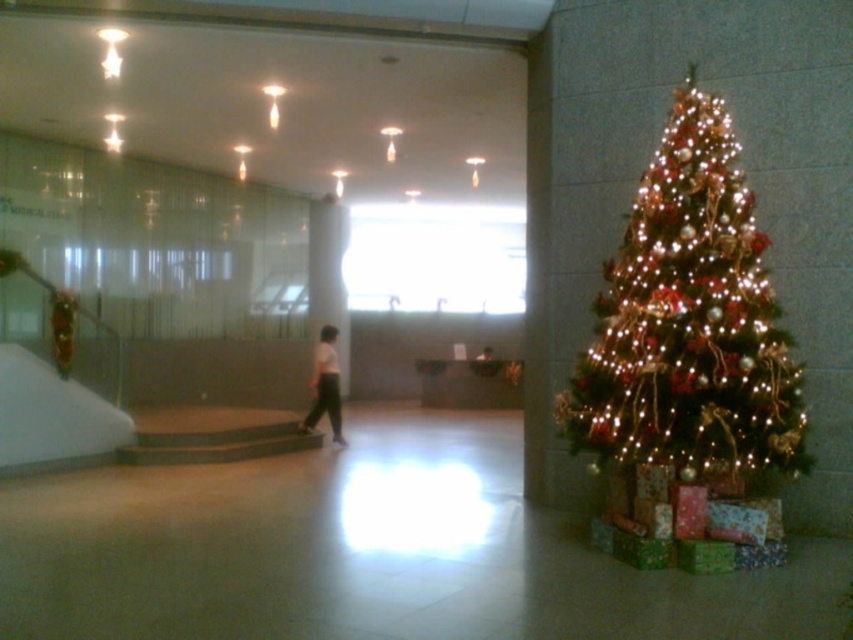
Question: Which object is closer to the camera taking this photo?

Choices:
 (A) iridescent gold christmas tree at right
 (B) white matte pants at center

Answer: (A)

Question: Which of the following is the closest to the observer?

Choices:
 (A) (630, 316)
 (B) (339, 419)

Answer: (A)

Question: Can you confirm if iridescent gold christmas tree at right is positioned below white matte pants at center?

Choices:
 (A) yes
 (B) no

Answer: (B)

Question: Does iridescent gold christmas tree at right have a lesser width compared to white matte pants at center?

Choices:
 (A) no
 (B) yes

Answer: (A)

Question: Does iridescent gold christmas tree at right have a smaller size compared to white matte pants at center?

Choices:
 (A) yes
 (B) no

Answer: (B)